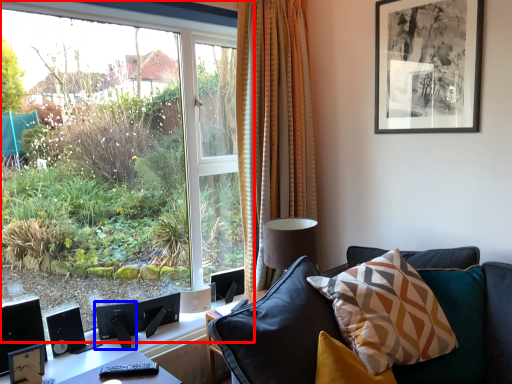
Question: Which object is closer to the camera taking this photo, window (highlighted by a red box) or speaker (highlighted by a blue box)?

Choices:
 (A) window
 (B) speaker

Answer: (A)